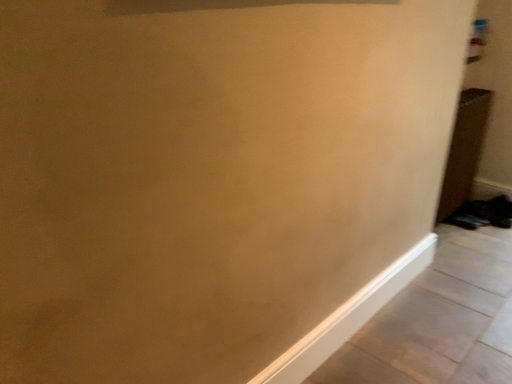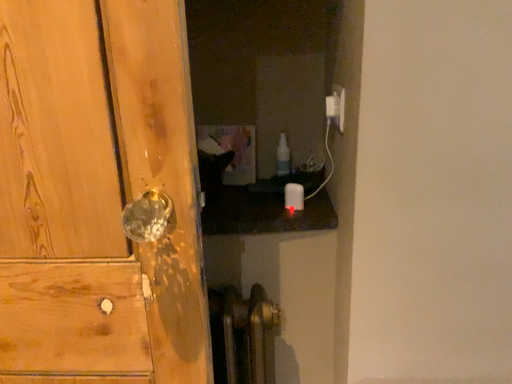
Question: Which way did the camera rotate in the video?

Choices:
 (A) rotated downward
 (B) rotated upward

Answer: (B)